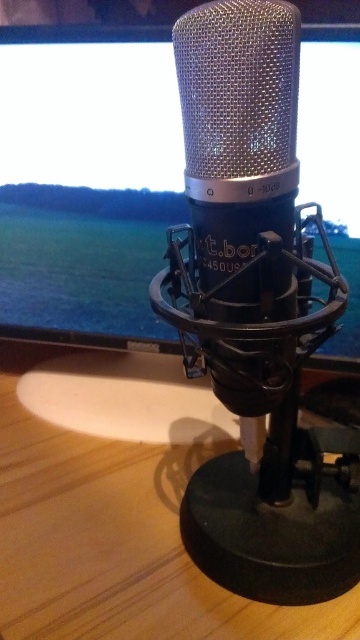
Is point (132, 216) positioned in front of point (43, 595)?

No, it is behind (43, 595).

Does matte black monitor at center lie behind wooden table at center?

Yes.

Is point (119, 268) farther from camera compared to point (78, 444)?

Yes, it is.

The height and width of the screenshot is (640, 360). In order to click on matte black monitor at center in this screenshot , I will do click(86, 180).